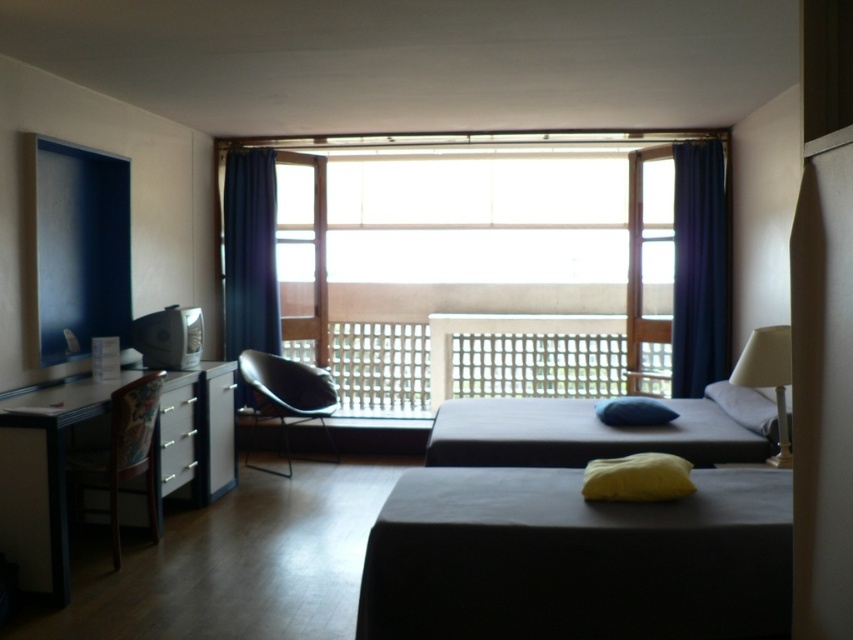
Question: Can you confirm if transparent glass window at center is positioned to the right of white glossy drawer at lower left?

Choices:
 (A) no
 (B) yes

Answer: (B)

Question: Which object is the farthest from the dark blue fabric curtain at center?

Choices:
 (A) dark blue fabric curtain at right
 (B) smooth gray table at lower center
 (C) dark gray fabric bed at lower right

Answer: (B)

Question: Among these points, which one is farthest from the camera?

Choices:
 (A) (323, 397)
 (B) (715, 369)
 (C) (543, 465)

Answer: (A)

Question: Does smooth gray table at lower center appear under dark blue fabric curtain at right?

Choices:
 (A) yes
 (B) no

Answer: (A)

Question: Can you confirm if transparent glass window at center is positioned to the right of transparent glass door at center?

Choices:
 (A) no
 (B) yes

Answer: (A)

Question: Based on their relative distances, which object is nearer to the wooden desk at left?

Choices:
 (A) transparent glass door at center
 (B) white glossy drawer at lower left
 (C) blue soft pillow at center

Answer: (B)